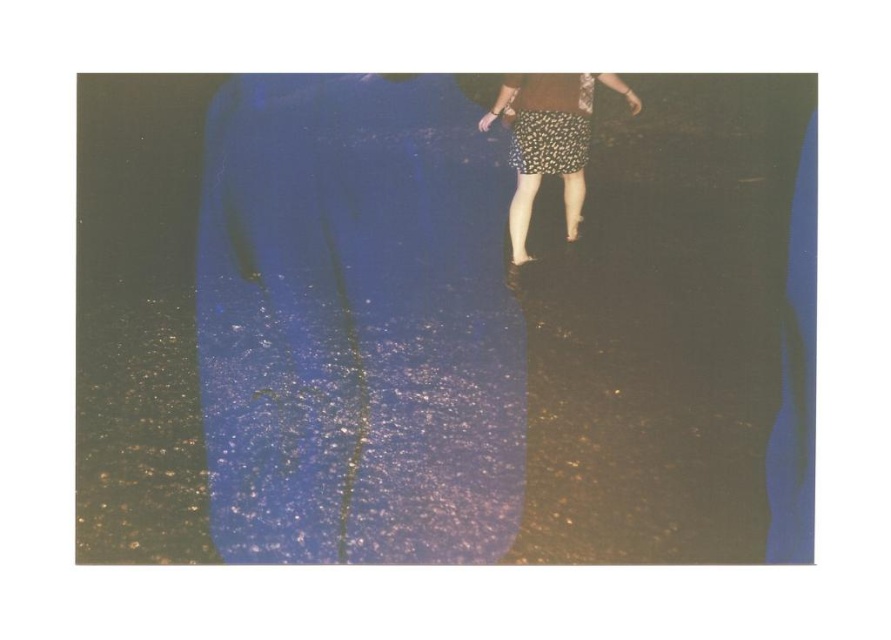
Question: Does floral skirt at center have a larger size compared to floral fabric dress at center?

Choices:
 (A) yes
 (B) no

Answer: (A)

Question: Where is floral skirt at center located in relation to floral fabric dress at center in the image?

Choices:
 (A) left
 (B) right

Answer: (B)

Question: Which point is farther to the camera?

Choices:
 (A) floral skirt at center
 (B) floral fabric dress at center

Answer: (A)

Question: Where is floral skirt at center located in relation to floral fabric dress at center in the image?

Choices:
 (A) left
 (B) right

Answer: (B)

Question: Among these points, which one is nearest to the camera?

Choices:
 (A) (607, 76)
 (B) (536, 136)

Answer: (B)